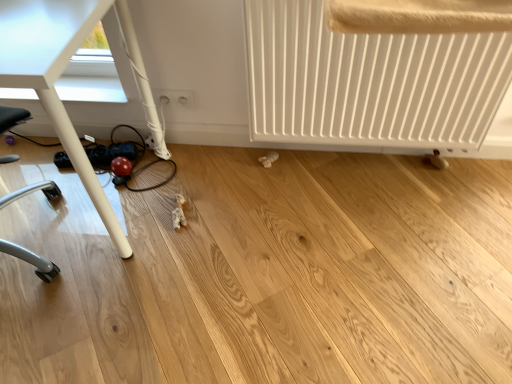
Find the location of `free location to the right of white glossy table at lower left`. free location to the right of white glossy table at lower left is located at coordinates (226, 230).